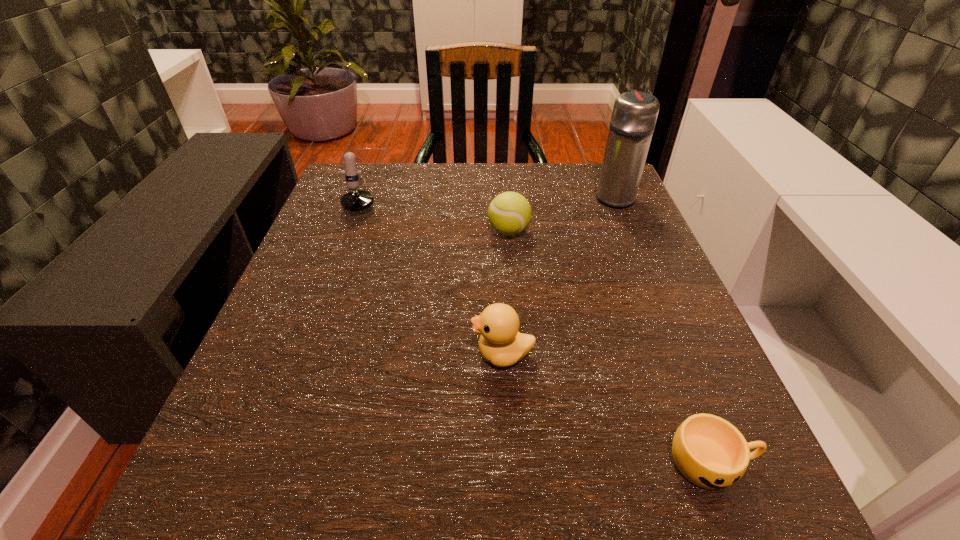
Locate an element on the screen. The image size is (960, 540). object that stands as the second closest to the tallest object is located at coordinates (500, 343).

The image size is (960, 540). What are the coordinates of `free space that satisfies the following two spatial constraints: 1. on the face of the shortest object; 2. on the left side of the duck` in the screenshot? It's located at (508, 462).

You are a GUI agent. You are given a task and a screenshot of the screen. Output one action in this format:
    pyautogui.click(x=<x>, y=<y>)
    Task: Click on the blank area in the image that satisfies the following two spatial constraints: 1. on the front side of the nearest object; 2. on the left side of the third farthest object
    
    Given the screenshot: What is the action you would take?
    pyautogui.click(x=528, y=462)

Locate an element on the screen. This screenshot has height=540, width=960. free spot that satisfies the following two spatial constraints: 1. on the face of the duck; 2. on the left side of the nearest object is located at coordinates (508, 462).